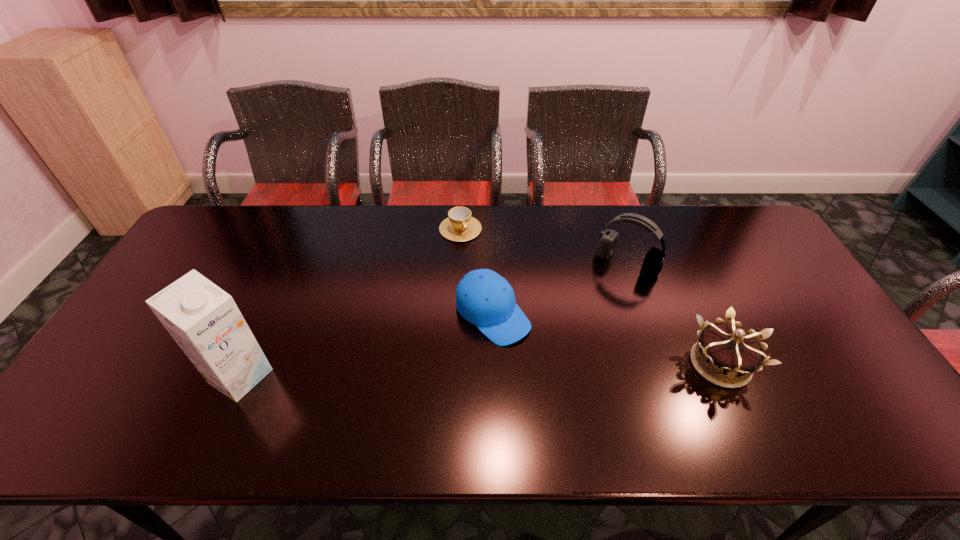
This screenshot has width=960, height=540. What are the coordinates of `the leftmost object` in the screenshot? It's located at (204, 320).

Locate an element on the screen. The height and width of the screenshot is (540, 960). the tallest object is located at coordinates (204, 320).

Where is `the third shortest object`? This screenshot has height=540, width=960. the third shortest object is located at coordinates coord(727,349).

Where is `cup`? cup is located at coordinates (459, 226).

Locate an element on the screen. This screenshot has height=540, width=960. the shortest object is located at coordinates (459, 226).

Find the location of a particular element. Image resolution: width=960 pixels, height=540 pixels. the fourth shortest object is located at coordinates point(652,265).

The height and width of the screenshot is (540, 960). I want to click on the fourth nearest object, so click(x=652, y=265).

The width and height of the screenshot is (960, 540). In order to click on the fourth tallest object in this screenshot , I will do `click(484, 298)`.

Where is `free location located 0.210m on the left of the tallest object`? free location located 0.210m on the left of the tallest object is located at coordinates point(127,376).

The width and height of the screenshot is (960, 540). In order to click on vacant space located 0.200m on the right of the third shortest object in this screenshot , I will do `click(838, 364)`.